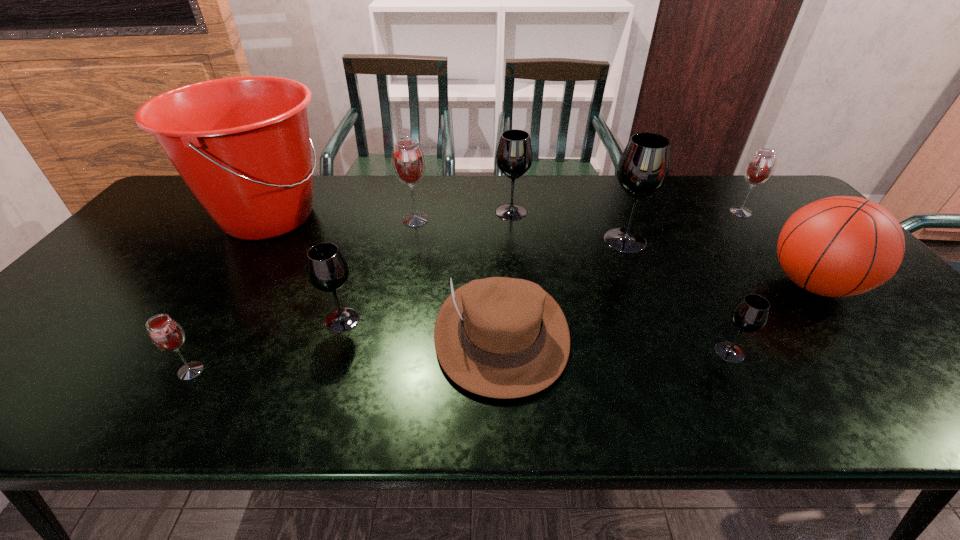
You are a GUI agent. You are given a task and a screenshot of the screen. Output one action in this format:
    pyautogui.click(x=<x>, y=<y>)
    Task: Click on the vacant space that satisfies the following two spatial constraints: 1. with the handle attached to the rim of the tallest object; 2. on the back side of the tallest wineglass
    The width and height of the screenshot is (960, 540).
    Given the screenshot: What is the action you would take?
    pyautogui.click(x=253, y=240)